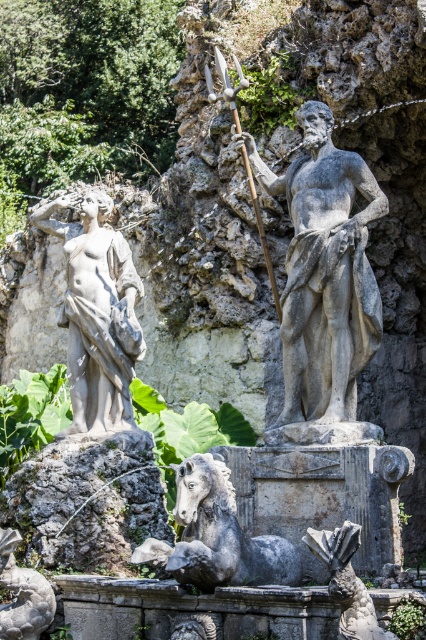
Is matte gray statue at left to the right of gray stone horse at center from the viewer's perspective?

No, matte gray statue at left is not to the right of gray stone horse at center.

Is matte gray statue at left below gray stone horse at center?

No.

Measure the distance between matte gray statue at left and camera.

220.21 feet

This screenshot has width=426, height=640. I want to click on matte gray statue at left, so click(97, 314).

Does gray stone statue at center have a greater width compared to polished bronze spear at center?

Indeed, gray stone statue at center has a greater width compared to polished bronze spear at center.

What do you see at coordinates (325, 273) in the screenshot?
I see `gray stone statue at center` at bounding box center [325, 273].

This screenshot has height=640, width=426. What are the coordinates of `gray stone statue at center` in the screenshot? It's located at (325, 273).

You are a GUI agent. You are given a task and a screenshot of the screen. Output one action in this format:
    pyautogui.click(x=<x>, y=<y>)
    Task: Click on the gray stone statue at center
    
    Given the screenshot: What is the action you would take?
    pyautogui.click(x=325, y=273)

Is the position of matte gray statue at left less distant than that of polished bronze spear at center?

No, matte gray statue at left is further to the viewer.

This screenshot has height=640, width=426. What do you see at coordinates (97, 314) in the screenshot?
I see `matte gray statue at left` at bounding box center [97, 314].

Image resolution: width=426 pixels, height=640 pixels. Find the location of `matte gray statue at left`. matte gray statue at left is located at coordinates (97, 314).

I want to click on matte gray statue at left, so click(x=97, y=314).